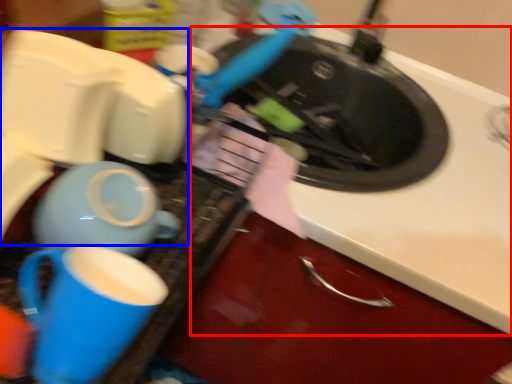
Question: Which object appears farthest to the camera in this image, counter top (highlighted by a red box) or appliance (highlighted by a blue box)?

Choices:
 (A) counter top
 (B) appliance

Answer: (A)